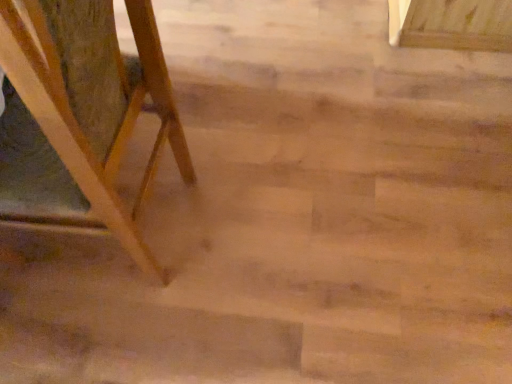
Find the location of a particular element. The image size is (512, 384). vacant area that lies in front of wooden easel at left is located at coordinates (112, 338).